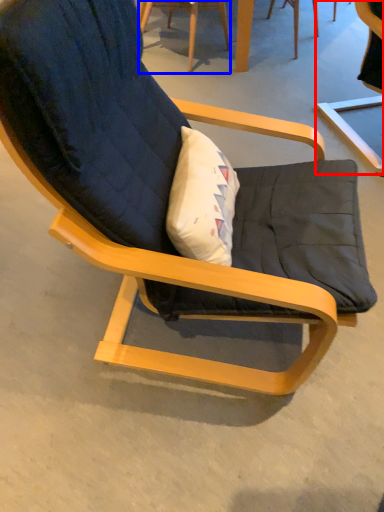
Question: Which of the following is the farthest to the observer, chair (highlighted by a red box) or chair (highlighted by a blue box)?

Choices:
 (A) chair
 (B) chair

Answer: (B)